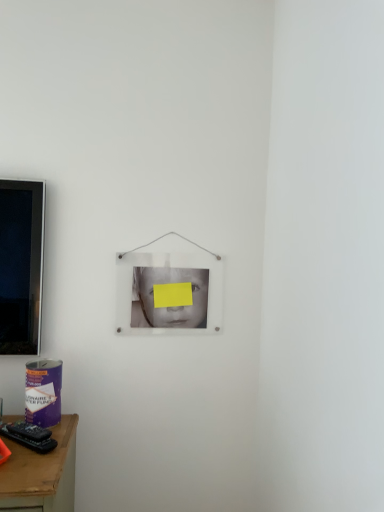
The image size is (384, 512). I want to click on transparent plastic photo frame at center, so click(x=168, y=283).

Describe the element at coordinates (168, 283) in the screenshot. I see `transparent plastic photo frame at center` at that location.

What are the coordinates of `transparent plastic photo frame at center` in the screenshot? It's located at (168, 283).